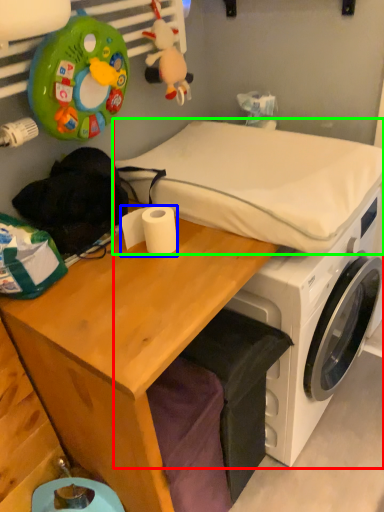
Question: Which object is positioned closest to machine (highlighted by a red box)? Select from toilet paper (highlighted by a blue box) and mattress (highlighted by a green box).

Choices:
 (A) toilet paper
 (B) mattress

Answer: (B)